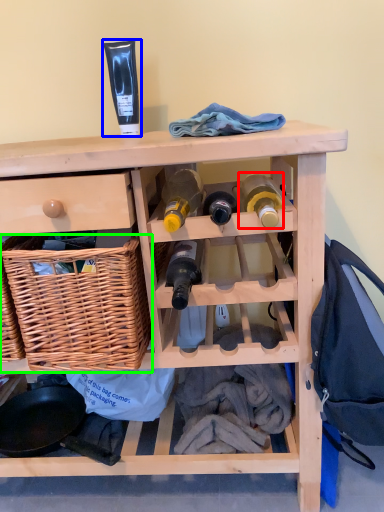
Question: Considering the real-world distances, which object is closest to bottle (highlighted by a red box)? toiletry (highlighted by a blue box) or basket (highlighted by a green box).

Choices:
 (A) toiletry
 (B) basket

Answer: (B)